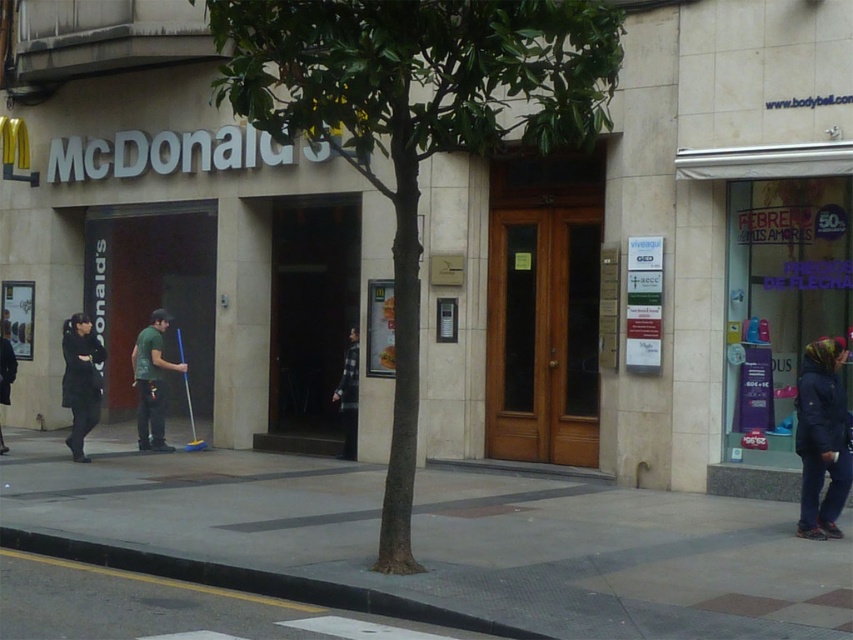
Question: Considering the real-world distances, which object is closest to the green leafy tree at center?

Choices:
 (A) flannel shirt at center
 (B) black leather jacket at left
 (C) dark gray jacket at lower left
 (D) smooth concrete pavement at center

Answer: (D)

Question: Can you confirm if smooth concrete pavement at center is bigger than green fabric shirt at left?

Choices:
 (A) no
 (B) yes

Answer: (B)

Question: Is black leather jacket at left positioned in front of flannel shirt at center?

Choices:
 (A) no
 (B) yes

Answer: (B)

Question: Which object is farther from the camera taking this photo?

Choices:
 (A) green leafy tree at center
 (B) flannel shirt at center
 (C) dark gray jacket at lower left

Answer: (C)

Question: Among these points, which one is nearest to the camera?

Choices:
 (A) pyautogui.click(x=76, y=413)
 (B) pyautogui.click(x=604, y=44)
 (C) pyautogui.click(x=848, y=460)
 (D) pyautogui.click(x=357, y=413)

Answer: (B)

Question: Does dark blue jacket at lower right appear on the left side of dark gray jacket at lower left?

Choices:
 (A) yes
 (B) no

Answer: (B)